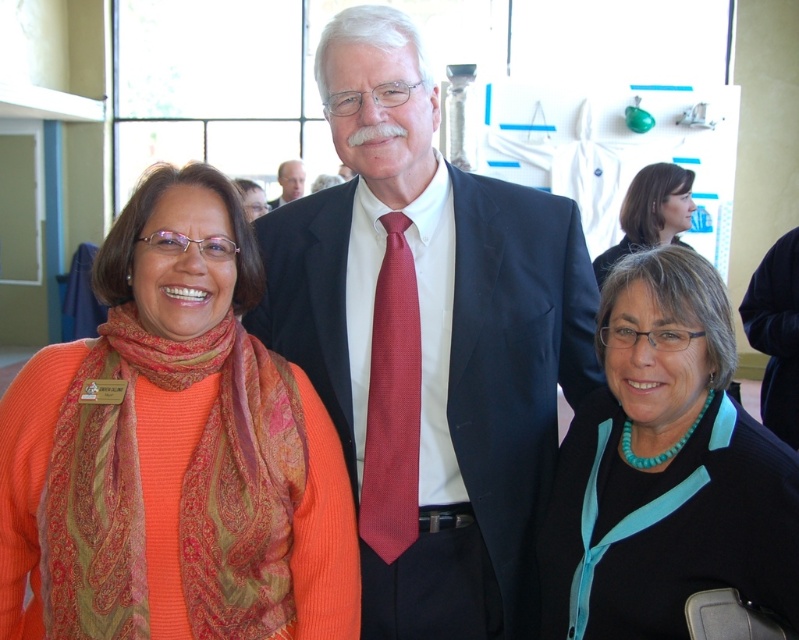
Question: Which point is farther from the camera taking this photo?

Choices:
 (A) (578, 561)
 (B) (611, 264)
 (C) (287, 196)
 (D) (364, 289)

Answer: (C)

Question: Among these objects, which one is nearest to the camera?

Choices:
 (A) paisley-patterned scarf at left
 (B) teal fabric blouse at upper right

Answer: (A)

Question: Does paisley-patterned scarf at left have a smaller size compared to teal fabric blouse at upper right?

Choices:
 (A) yes
 (B) no

Answer: (A)

Question: Does paisley-patterned scarf at left have a lesser width compared to teal fabric blouse at upper right?

Choices:
 (A) yes
 (B) no

Answer: (A)

Question: Which object is farther from the camera taking this photo?

Choices:
 (A) matte black suit at center
 (B) paisley-patterned scarf at left

Answer: (A)

Question: In this image, where is teal glossy necklace at lower right located relative to teal fabric blouse at upper right?

Choices:
 (A) left
 (B) right

Answer: (A)